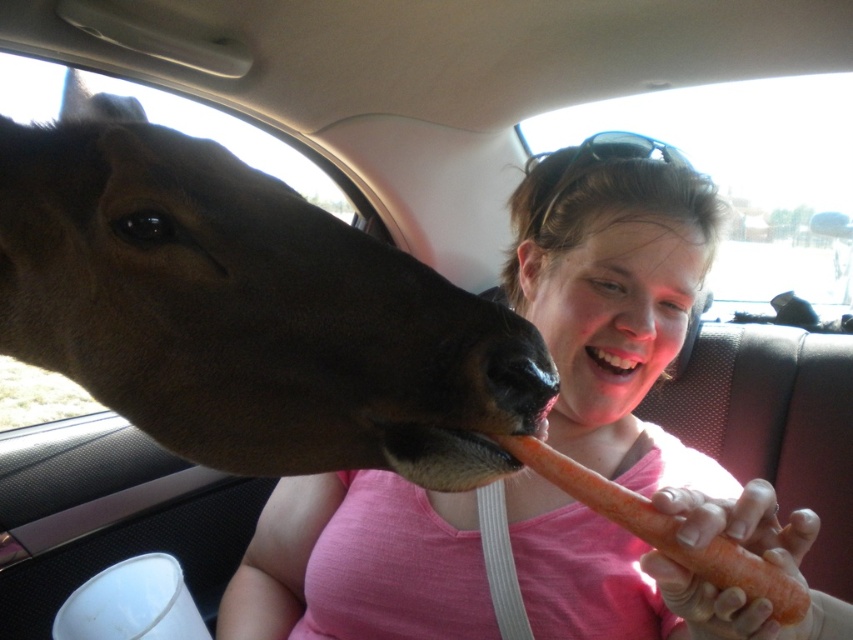
Consider the image. Is brown glossy horse head at left smaller than transparent glass car window at upper center?

Correct, brown glossy horse head at left occupies less space than transparent glass car window at upper center.

What do you see at coordinates (242, 308) in the screenshot?
I see `brown glossy horse head at left` at bounding box center [242, 308].

Is point (273, 387) closer to viewer compared to point (759, 202)?

Yes, point (273, 387) is in front of point (759, 202).

Locate an element on the screen. brown glossy horse head at left is located at coordinates (242, 308).

Which is more to the right, brown glossy horse head at left or pink matte nose at center?

pink matte nose at center

Is brown glossy horse head at left closer to camera compared to pink matte nose at center?

Yes, brown glossy horse head at left is in front of pink matte nose at center.

This screenshot has height=640, width=853. Find the location of `brown glossy horse head at left`. brown glossy horse head at left is located at coordinates (242, 308).

Who is taller, transparent glass car window at upper center or smooth orange carrot at lower center?

transparent glass car window at upper center

Is transparent glass car window at upper center behind smooth orange carrot at lower center?

That is True.

I want to click on transparent glass car window at upper center, so click(750, 179).